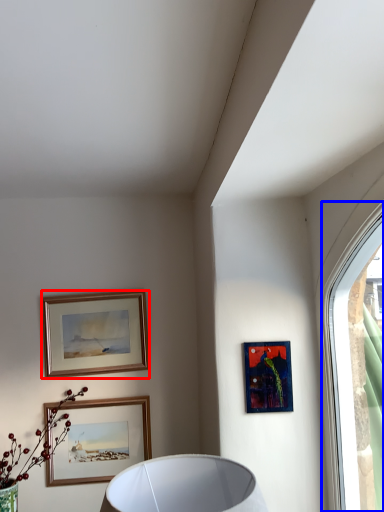
Question: Which object is closer to the camera taking this photo, picture frame (highlighted by a red box) or window (highlighted by a blue box)?

Choices:
 (A) picture frame
 (B) window

Answer: (B)